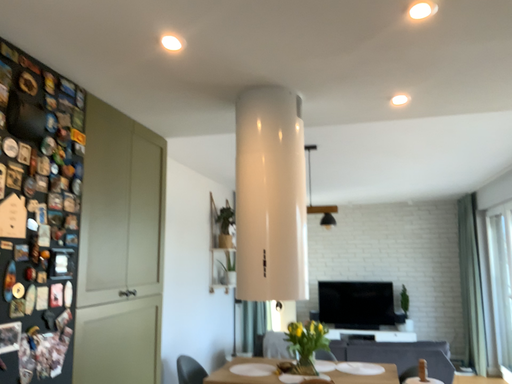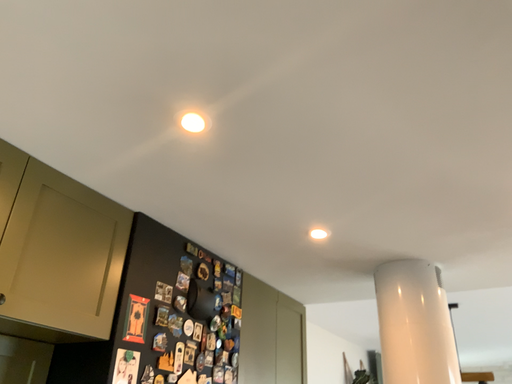
Question: How did the camera likely rotate when shooting the video?

Choices:
 (A) rotated upward
 (B) rotated downward

Answer: (A)